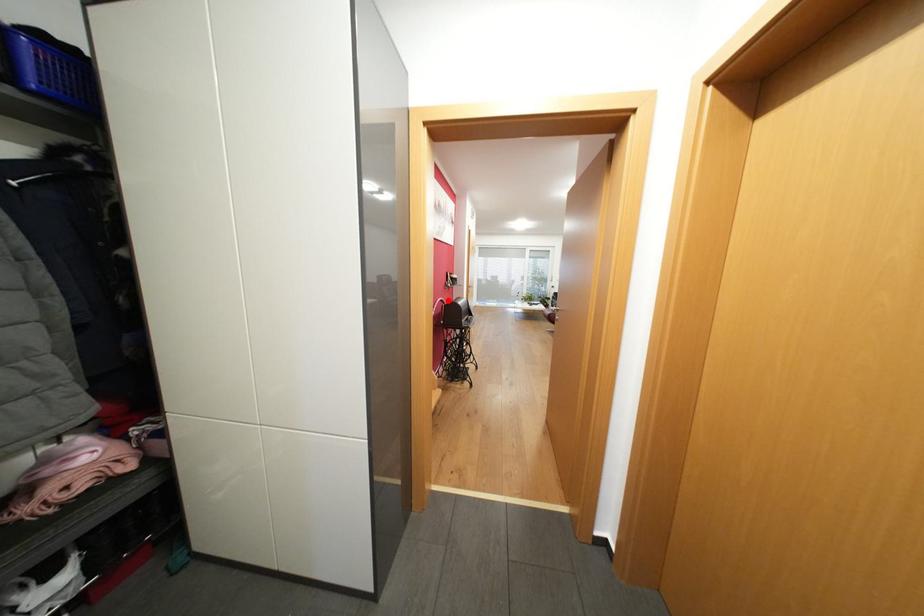
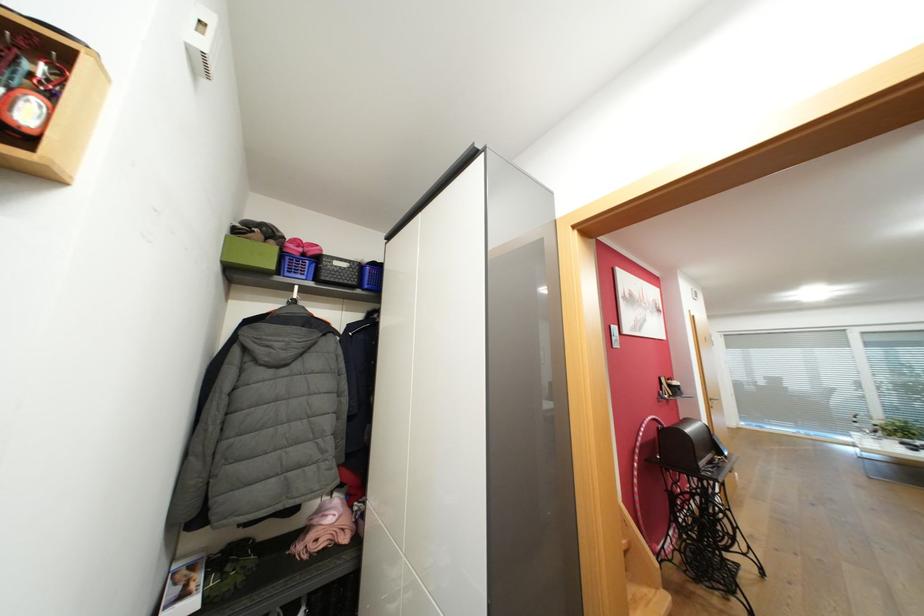
Locate, in the second image, the point that corresponds to the highlighted location in the first image.

(661, 419)